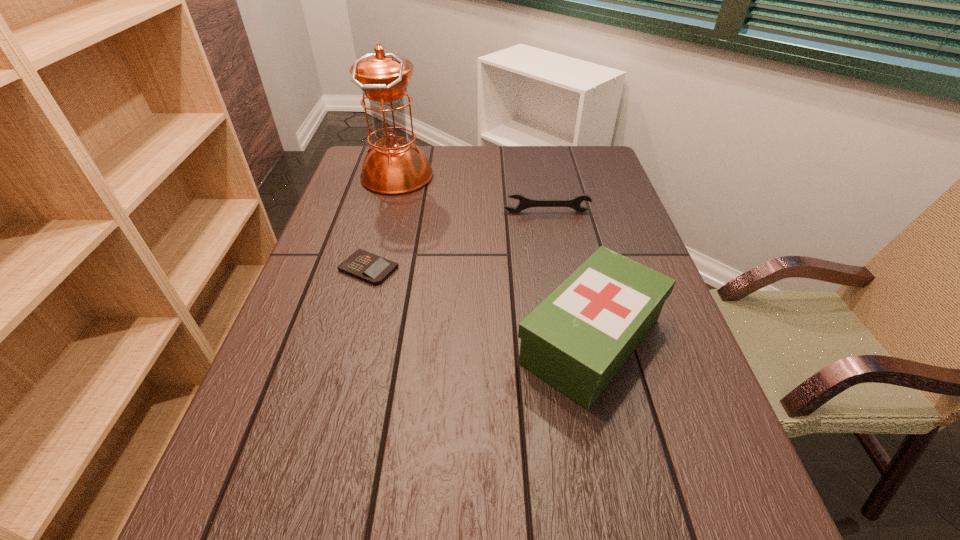
The height and width of the screenshot is (540, 960). In order to click on object located at the far edge in this screenshot , I will do `click(394, 165)`.

Where is `oil lamp positioned at the left edge`? Image resolution: width=960 pixels, height=540 pixels. oil lamp positioned at the left edge is located at coordinates (394, 165).

Where is `calculator at the left edge`? The height and width of the screenshot is (540, 960). calculator at the left edge is located at coordinates (366, 266).

Where is `the first-aid kit present at the right edge`? The width and height of the screenshot is (960, 540). the first-aid kit present at the right edge is located at coordinates (577, 339).

This screenshot has width=960, height=540. Find the location of `wrench present at the right edge`. wrench present at the right edge is located at coordinates (524, 203).

Where is `object at the far left corner`? The image size is (960, 540). object at the far left corner is located at coordinates (394, 165).

Locate an element on the screen. The height and width of the screenshot is (540, 960). vacant space at the far edge of the desktop is located at coordinates coord(522,148).

In the image, there is a desktop. Where is `vacant space at the near edge`? The image size is (960, 540). vacant space at the near edge is located at coordinates (587, 539).

You are a GUI agent. You are given a task and a screenshot of the screen. Output one action in this format:
    pyautogui.click(x=<x>, y=<y>)
    Task: Click on the free space at the left edge of the desktop
    The width and height of the screenshot is (960, 540).
    Given the screenshot: What is the action you would take?
    pyautogui.click(x=323, y=361)

The height and width of the screenshot is (540, 960). I want to click on free spot at the right edge of the desktop, so click(x=651, y=342).